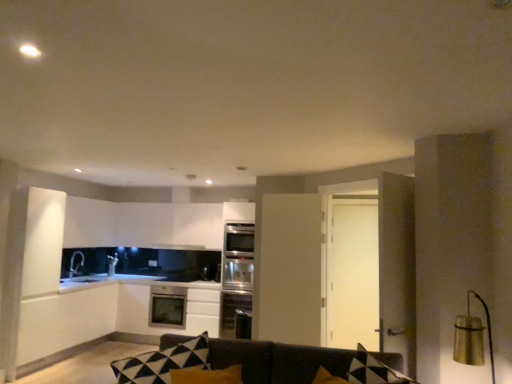
Question: Is gold metallic lampshade at right completely or partially outside of black matte exhaust hood at upper center?

Choices:
 (A) yes
 (B) no

Answer: (A)

Question: From the image's perspective, does gold metallic lampshade at right appear lower than black matte exhaust hood at upper center?

Choices:
 (A) no
 (B) yes

Answer: (A)

Question: From a real-world perspective, is gold metallic lampshade at right located higher than black matte exhaust hood at upper center?

Choices:
 (A) yes
 (B) no

Answer: (B)

Question: Is gold metallic lampshade at right positioned far away from black matte exhaust hood at upper center?

Choices:
 (A) no
 (B) yes

Answer: (B)

Question: Is gold metallic lampshade at right facing away from black matte exhaust hood at upper center?

Choices:
 (A) yes
 (B) no

Answer: (B)

Question: Considering the relative positions of satin black microwave at center and dark gray fabric couch at center in the image provided, is satin black microwave at center to the left or to the right of dark gray fabric couch at center?

Choices:
 (A) left
 (B) right

Answer: (A)

Question: Based on their sizes in the image, would you say satin black microwave at center is bigger or smaller than dark gray fabric couch at center?

Choices:
 (A) small
 (B) big

Answer: (A)

Question: Is satin black microwave at center inside or outside of dark gray fabric couch at center?

Choices:
 (A) outside
 (B) inside

Answer: (A)

Question: From a real-world perspective, is satin black microwave at center physically located above or below dark gray fabric couch at center?

Choices:
 (A) below
 (B) above

Answer: (B)

Question: From a real-world perspective, is black matte exhaust hood at upper center positioned above or below satin silver dishwasher at center?

Choices:
 (A) above
 (B) below

Answer: (A)

Question: Is point (x=164, y=244) closer or farther from the camera than point (x=175, y=299)?

Choices:
 (A) farther
 (B) closer

Answer: (A)

Question: In terms of height, does black matte exhaust hood at upper center look taller or shorter compared to satin silver dishwasher at center?

Choices:
 (A) short
 (B) tall

Answer: (A)

Question: From the image's perspective, is black matte exhaust hood at upper center above or below satin silver dishwasher at center?

Choices:
 (A) below
 (B) above

Answer: (B)

Question: Looking at the image, does black matte exhaust hood at upper center seem bigger or smaller compared to satin silver oven at center?

Choices:
 (A) small
 (B) big

Answer: (A)

Question: From a real-world perspective, is black matte exhaust hood at upper center above or below satin silver oven at center?

Choices:
 (A) below
 (B) above

Answer: (B)